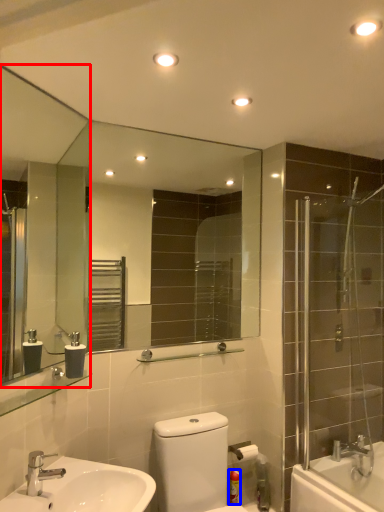
Question: Which of the following is the farthest to the observer, mirror (highlighted by a red box) or toiletry (highlighted by a blue box)?

Choices:
 (A) mirror
 (B) toiletry

Answer: (B)